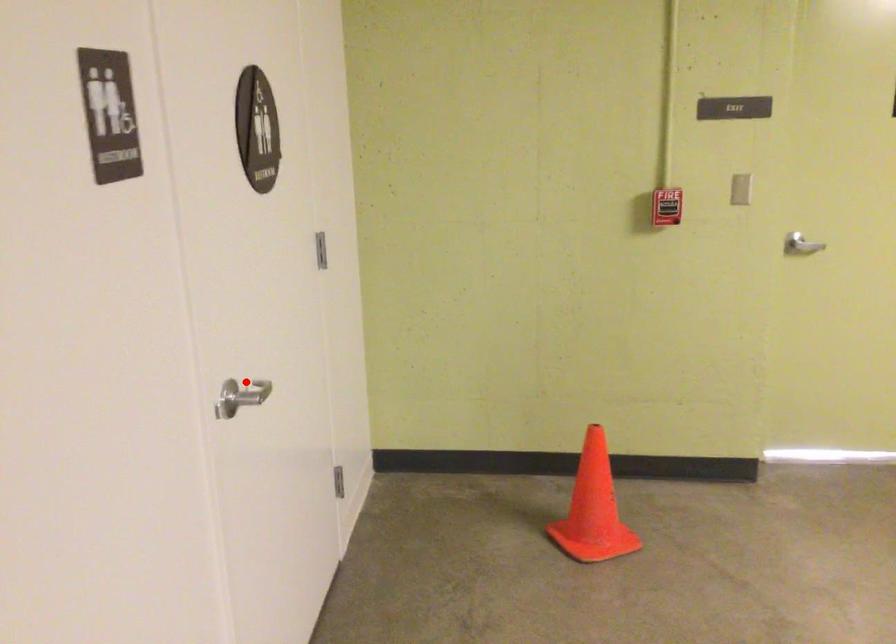
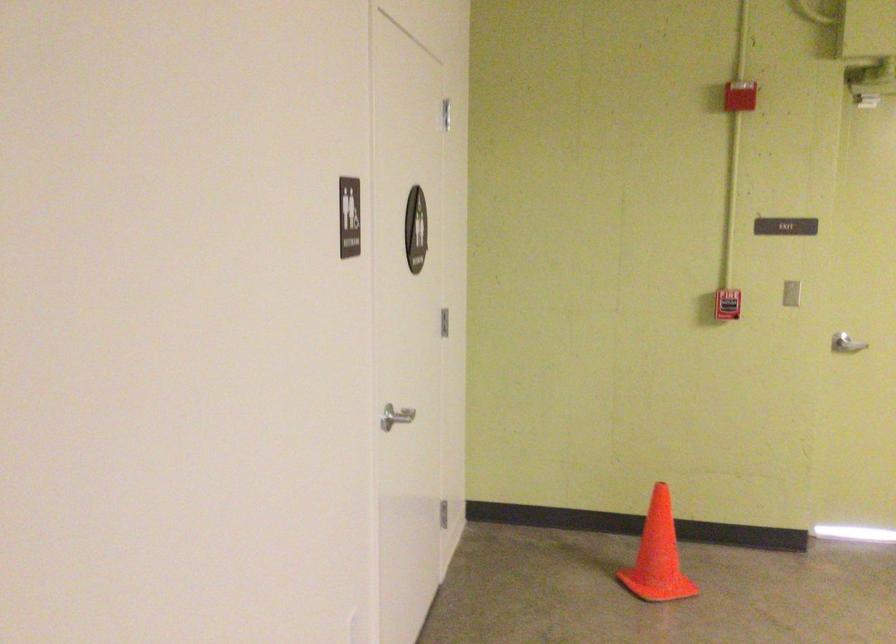
Question: I am providing you with two images of the same scene from different viewpoints. Image1 has a red point marked. In image2, the corresponding 3D location appears at what relative position? Reply with the corresponding letter.

Choices:
 (A) Closer
 (B) Farther

Answer: (B)